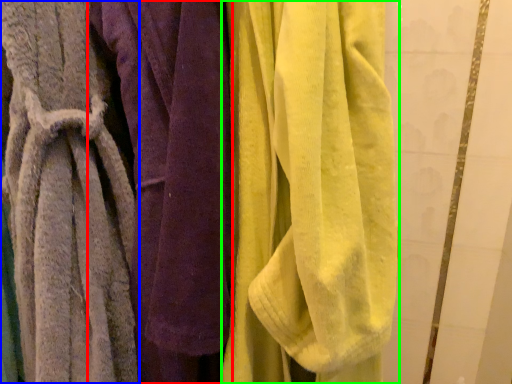
Question: Which object is positioned closest to towel (highlighted by a red box)? Select from towel (highlighted by a blue box) and towel (highlighted by a green box).

Choices:
 (A) towel
 (B) towel

Answer: (A)